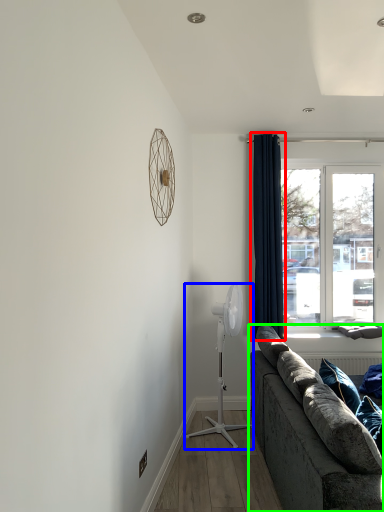
Question: Which object is the farthest from curtain (highlighted by a red box)? Choose among these: mechanical fan (highlighted by a blue box) or studio couch (highlighted by a green box).

Choices:
 (A) mechanical fan
 (B) studio couch

Answer: (B)